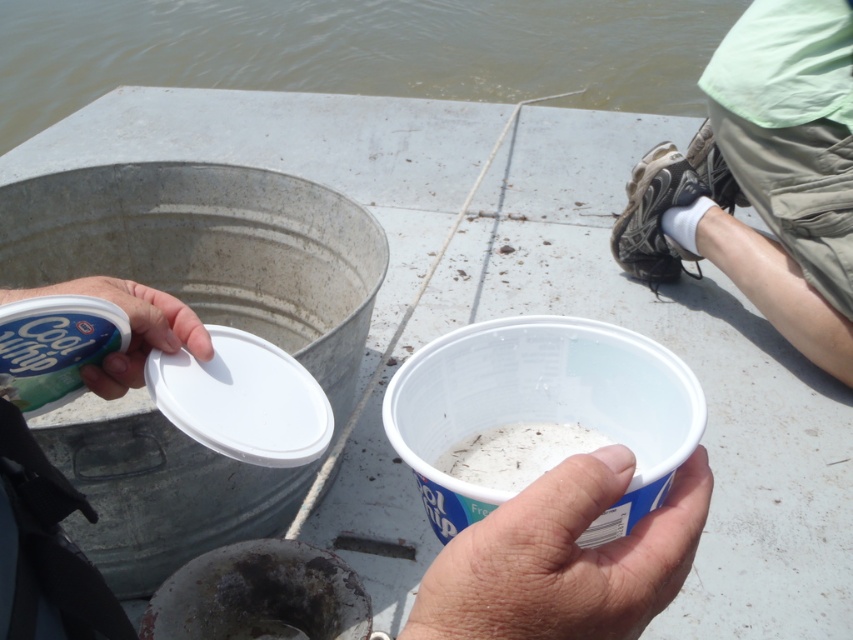
Is point (103, 86) positioned behind point (743, 90)?

Yes, point (103, 86) is farther from viewer.

The width and height of the screenshot is (853, 640). What do you see at coordinates (357, 51) in the screenshot? I see `brown water at upper center` at bounding box center [357, 51].

Where is `brown water at upper center`? brown water at upper center is located at coordinates (357, 51).

Can you confirm if brown water at upper center is thinner than white plastic lid at center?

No, brown water at upper center is not thinner than white plastic lid at center.

Describe the element at coordinates (357, 51) in the screenshot. The height and width of the screenshot is (640, 853). I see `brown water at upper center` at that location.

Measure the distance between point (48, 54) and camera.

Point (48, 54) is 15.83 feet away from camera.

Find the location of a particular element. This screenshot has height=640, width=853. brown water at upper center is located at coordinates (357, 51).

Does green fabric shorts at lower right come in front of white matte plastic cup at lower center?

No, green fabric shorts at lower right is further to the viewer.

Which is behind, point (758, 259) or point (601, 465)?

The point (758, 259) is behind.

Locate an element on the screen. The height and width of the screenshot is (640, 853). green fabric shorts at lower right is located at coordinates (763, 179).